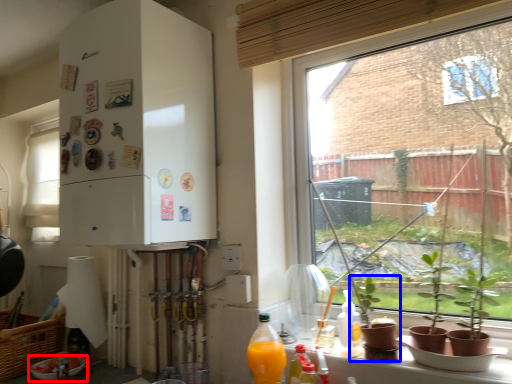
Question: Which object is closer to the camera taking this photo, bowl (highlighted by a red box) or houseplant (highlighted by a blue box)?

Choices:
 (A) bowl
 (B) houseplant

Answer: (B)